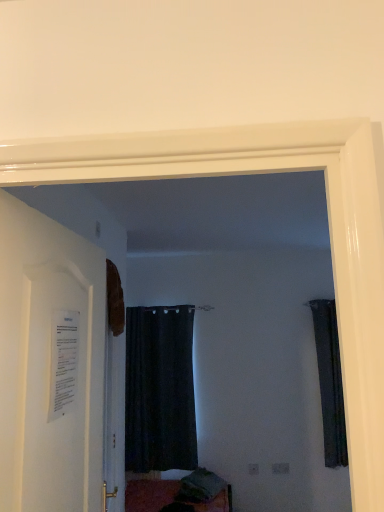
Question: Considering the positions of dark fabric curtain at right, which is the 2th curtain in left-to-right order, and white paper at left in the image, is dark fabric curtain at right, which is the 2th curtain in left-to-right order, taller or shorter than white paper at left?

Choices:
 (A) short
 (B) tall

Answer: (B)

Question: Considering the positions of point (324, 340) and point (41, 252), is point (324, 340) closer or farther from the camera than point (41, 252)?

Choices:
 (A) closer
 (B) farther

Answer: (B)

Question: Which object is positioned closest to the black matte curtain at center, the second curtain from the right?

Choices:
 (A) dark fabric curtain at right, which is the 2th curtain in left-to-right order
 (B) white paper at left

Answer: (A)

Question: Which object is positioned farthest from the white paper at left?

Choices:
 (A) black matte curtain at center, the second curtain from the right
 (B) dark fabric curtain at right, which is the 2th curtain in left-to-right order

Answer: (B)